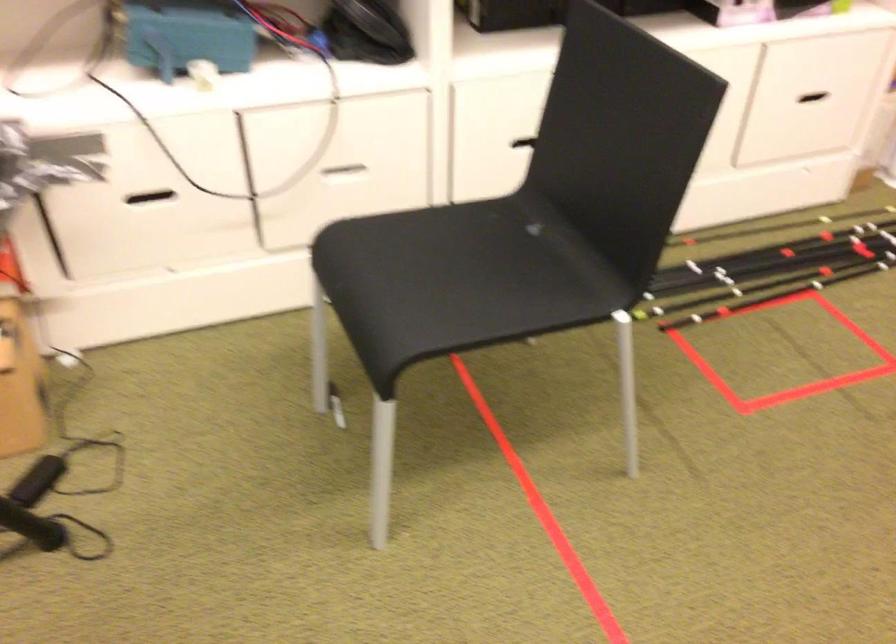
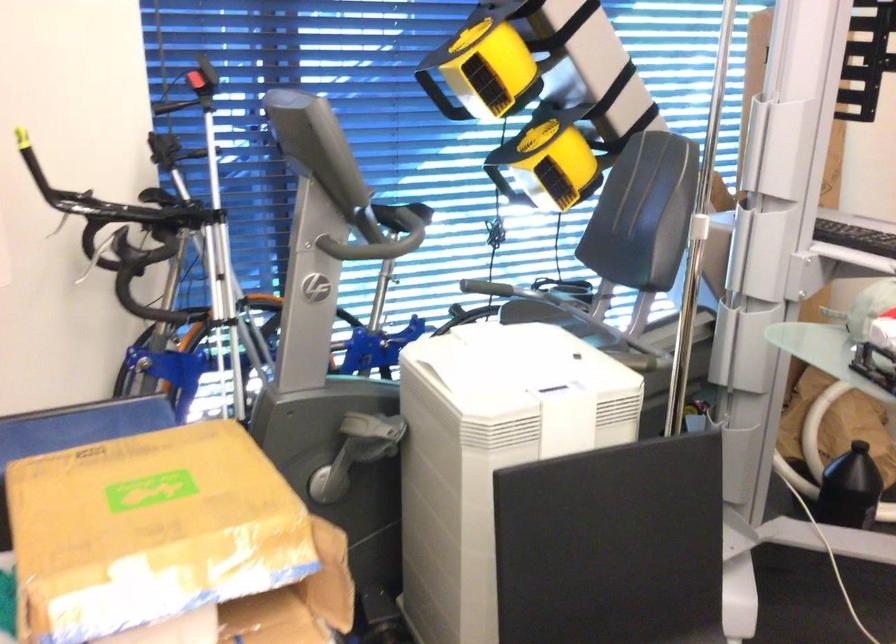
Question: The images are taken continuously from a first-person perspective. In which direction is your viewpoint rotating?

Choices:
 (A) Left
 (B) Right
 (C) Up
 (D) Down

Answer: (A)